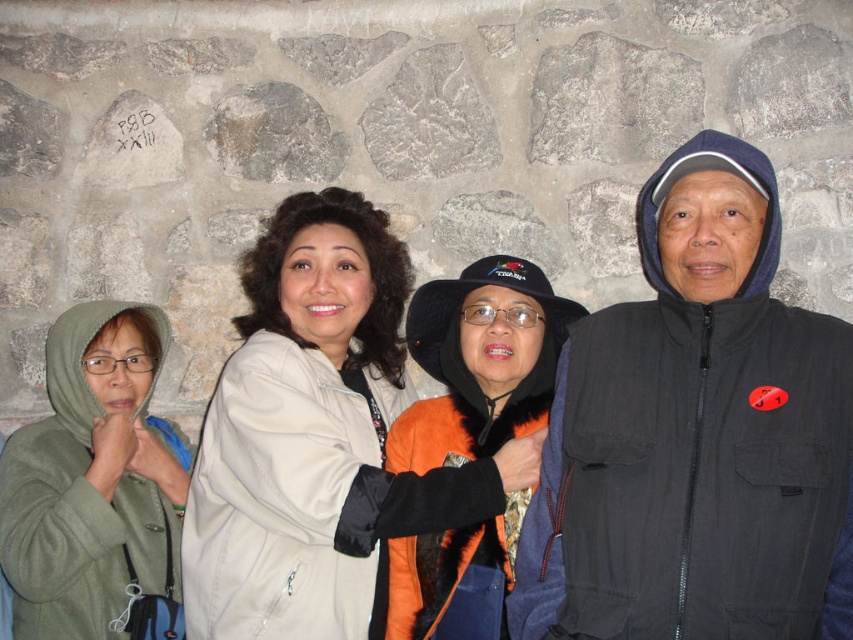
You are taking a photo of the group and want to ensure that both the point at point (685, 369) and the point at point (548, 326) are in focus. Which point should you focus on to ensure both are sharp?

You should focus on point (685, 369) because it is closer to the camera than point (548, 326), so focusing on the closer point will ensure the farther point is also in focus.

You are a photographer trying to capture a photo of the group. The green fleece jacket at lower left and the orange fuzzy jacket at center are in your viewfinder. Which jacket should you focus on if you want to ensure both are in focus without adjusting the camera settings?

The green fleece jacket at lower left is positioned under the orange fuzzy jacket at center, so focusing on the orange fuzzy jacket at center would likely keep both in focus since it is closer to the camera.